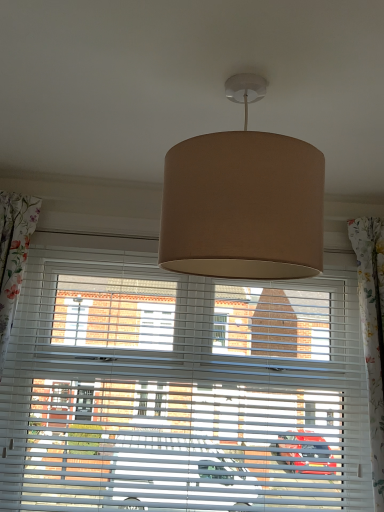
Describe the element at coordinates (180, 387) in the screenshot. I see `white matte window blind at center` at that location.

Measure the distance between white matte window blind at center and camera.

white matte window blind at center and camera are 1.54 meters apart.

Identify the location of white matte window blind at center. (180, 387).

The image size is (384, 512). What do you see at coordinates (243, 201) in the screenshot?
I see `beige fabric lampshade at center` at bounding box center [243, 201].

Locate an element on the screen. This screenshot has width=384, height=512. beige fabric lampshade at center is located at coordinates (243, 201).

The image size is (384, 512). Identify the location of white matte window blind at center. (180, 387).

Is beige fabric lampshade at center to the left of white matte window blind at center from the viewer's perspective?

Incorrect, beige fabric lampshade at center is not on the left side of white matte window blind at center.

Which is in front, beige fabric lampshade at center or white matte window blind at center?

beige fabric lampshade at center is closer to the camera.

Between point (190, 186) and point (232, 320), which one is positioned in front?

The point (190, 186) is more forward.

From the image's perspective, which is above, beige fabric lampshade at center or white matte window blind at center?

beige fabric lampshade at center.

From a real-world perspective, which object rests below the other?

white matte window blind at center, from a real-world perspective.

Which of these two, beige fabric lampshade at center or white matte window blind at center, is wider?

beige fabric lampshade at center.

Does beige fabric lampshade at center have a lesser height compared to white matte window blind at center?

Yes, beige fabric lampshade at center is shorter than white matte window blind at center.

Who is smaller, beige fabric lampshade at center or white matte window blind at center?

With smaller size is beige fabric lampshade at center.

Is beige fabric lampshade at center surrounding white matte window blind at center?

No, beige fabric lampshade at center does not contain white matte window blind at center.

Are beige fabric lampshade at center and white matte window blind at center far apart?

Actually, beige fabric lampshade at center and white matte window blind at center are a little close together.

Could you tell me if beige fabric lampshade at center is facing white matte window blind at center?

No, beige fabric lampshade at center does not turn towards white matte window blind at center.

Locate an element on the screen. Image resolution: width=384 pixels, height=512 pixels. lamp that is in front of the white matte window blind at center is located at coordinates (243, 201).

Based on the photo, in the image, is white matte window blind at center on the left side or the right side of beige fabric lampshade at center?

In the image, white matte window blind at center appears on the left side of beige fabric lampshade at center.

Is white matte window blind at center behind beige fabric lampshade at center?

Yes, it is.

Which point is more forward, [251,390] or [262,260]?

Point [262,260]

From the image's perspective, is white matte window blind at center beneath beige fabric lampshade at center?

Yes, from the image's perspective, white matte window blind at center is below beige fabric lampshade at center.

From a real-world perspective, who is located lower, white matte window blind at center or beige fabric lampshade at center?

white matte window blind at center.

Does white matte window blind at center have a greater width compared to beige fabric lampshade at center?

Incorrect, the width of white matte window blind at center does not surpass that of beige fabric lampshade at center.

From their relative heights in the image, would you say white matte window blind at center is taller or shorter than beige fabric lampshade at center?

Considering their sizes, white matte window blind at center has more height than beige fabric lampshade at center.

Is white matte window blind at center bigger or smaller than beige fabric lampshade at center?

Clearly, white matte window blind at center is larger in size than beige fabric lampshade at center.

Which is correct: white matte window blind at center is inside beige fabric lampshade at center, or outside of it?

white matte window blind at center is located beyond the bounds of beige fabric lampshade at center.

Is white matte window blind at center far away from beige fabric lampshade at center?

white matte window blind at center is near beige fabric lampshade at center, not far away.

Is white matte window blind at center oriented towards beige fabric lampshade at center?

Yes, white matte window blind at center is aimed at beige fabric lampshade at center.

Measure the distance from white matte window blind at center to beige fabric lampshade at center.

white matte window blind at center and beige fabric lampshade at center are 33.26 inches apart from each other.

Find the location of a particular element. The image size is (384, 512). lamp that appears above the white matte window blind at center (from a real-world perspective) is located at coordinates (243, 201).

This screenshot has height=512, width=384. Find the location of `lamp in front of the white matte window blind at center`. lamp in front of the white matte window blind at center is located at coordinates (243, 201).

This screenshot has height=512, width=384. What are the coordinates of `lamp above the white matte window blind at center (from the image's perspective)` in the screenshot? It's located at (243, 201).